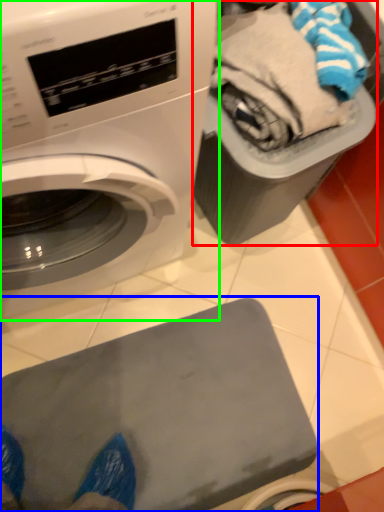
Question: Which object is the closest to the garbage (highlighted by a red box)? Choose among these: appliance (highlighted by a blue box) or washing machine (highlighted by a green box).

Choices:
 (A) appliance
 (B) washing machine

Answer: (B)